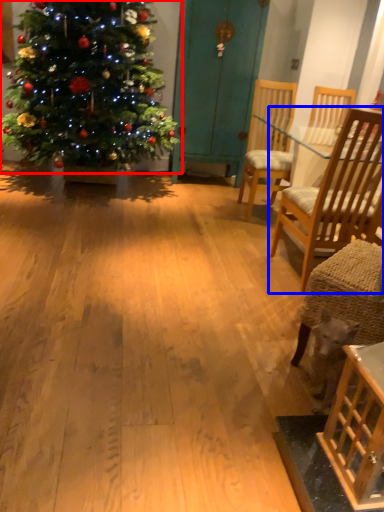
Question: Which object appears closest to the camera in this image, christmas tree (highlighted by a red box) or chair (highlighted by a blue box)?

Choices:
 (A) christmas tree
 (B) chair

Answer: (B)